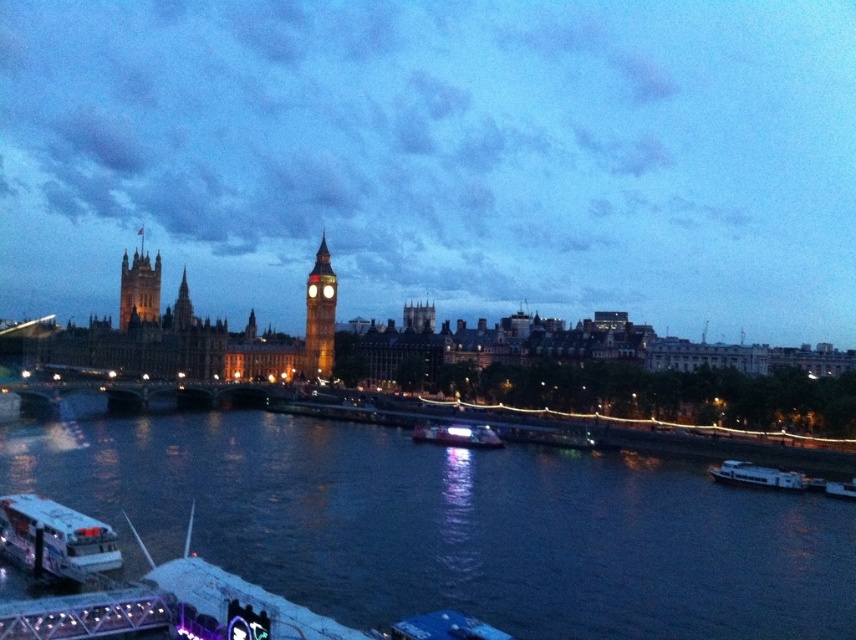
You are standing on the walkway near the River Thames and want to take a photo of both the point at coordinates point (741, 506) and point (67, 518). Since you want both points in focus, you need to know which point is closer to you. Which point is closer?

Point (67, 518) is closer to you because the description states that point (741, 506) is further away from the viewer compared to point (67, 518).

You are standing on the walkway in the foreground of the scene. You see the dark blue water at lower center and the white plastic boat at lower left. Which object is positioned more to the left side of the scene?

The white plastic boat at lower left is positioned more to the left side of the scene.

You are standing on the walkway in the foreground of the scene. You want to compare the height of the dark blue water at lower center and the golden stone tower at left. Which one is taller?

The golden stone tower at left is taller than the dark blue water at lower center.